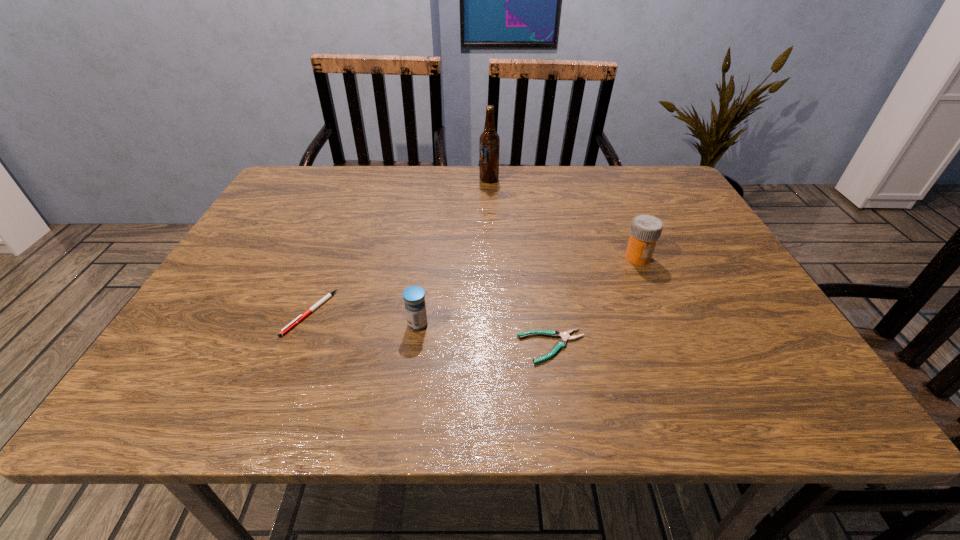
In the image, there is a desktop. Where is `vacant space at the left edge`? Image resolution: width=960 pixels, height=540 pixels. vacant space at the left edge is located at coordinates (196, 367).

The image size is (960, 540). In the image, there is a desktop. In order to click on vacant space at the far right corner in this screenshot , I will do `click(642, 170)`.

The height and width of the screenshot is (540, 960). Find the location of `free space at the near right corner`. free space at the near right corner is located at coordinates (741, 394).

Locate an element on the screen. The width and height of the screenshot is (960, 540). vacant point located between the pliers and the farther medicine is located at coordinates (595, 302).

Where is `vacant area between the beer bottle and the second shortest object`? vacant area between the beer bottle and the second shortest object is located at coordinates (399, 246).

This screenshot has height=540, width=960. What are the coordinates of `free space between the fourth object from left to right and the tallest object` in the screenshot? It's located at (520, 263).

At what (x,y) coordinates should I click in order to perform the action: click on free area in between the tallest object and the nearer medicine. Please return your answer as a coordinate pair (x, y). The image size is (960, 540). Looking at the image, I should click on (453, 252).

In order to click on free space that is in between the farthest object and the farther medicine in this screenshot , I will do `click(564, 219)`.

The height and width of the screenshot is (540, 960). I want to click on free space between the third object from left to right and the farther medicine, so click(x=564, y=219).

The height and width of the screenshot is (540, 960). I want to click on free space between the right medicine and the leftmost object, so click(x=474, y=285).